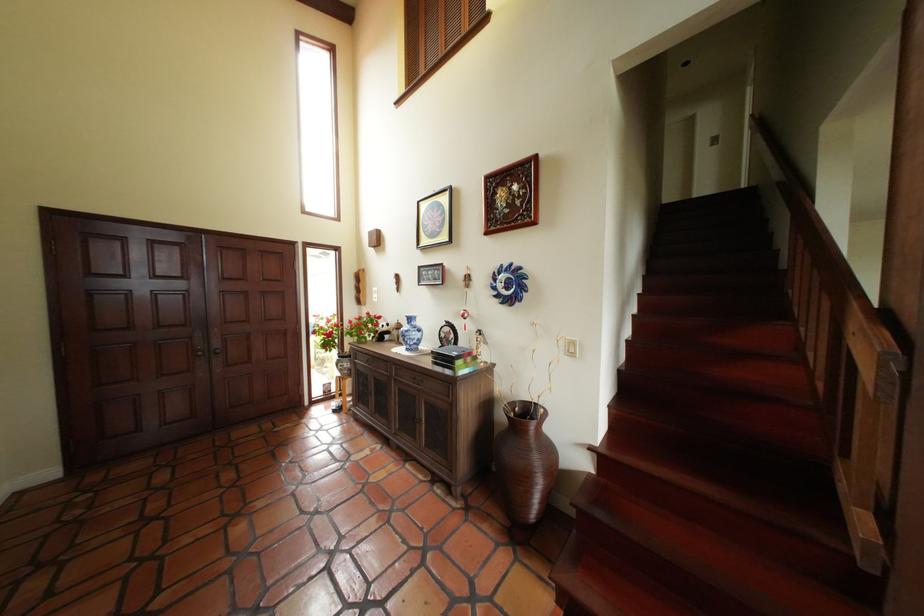
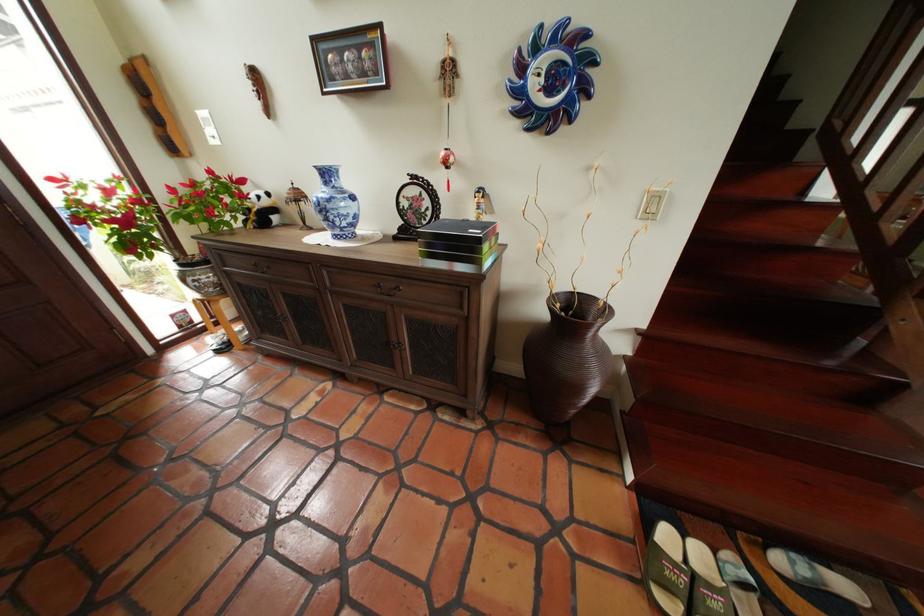
In the second image, find the point that corresponds to [394,326] in the first image.

(265, 197)